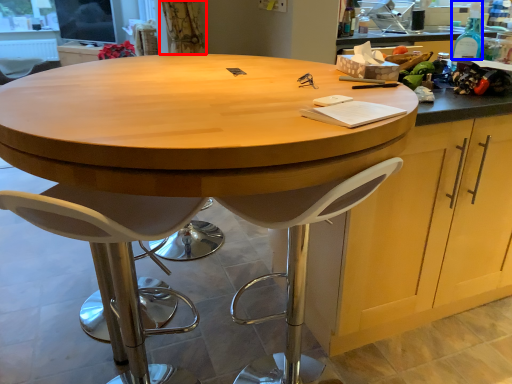
Question: Among these objects, which one is farthest to the camera, curtain (highlighted by a red box) or bottle (highlighted by a blue box)?

Choices:
 (A) curtain
 (B) bottle

Answer: (A)